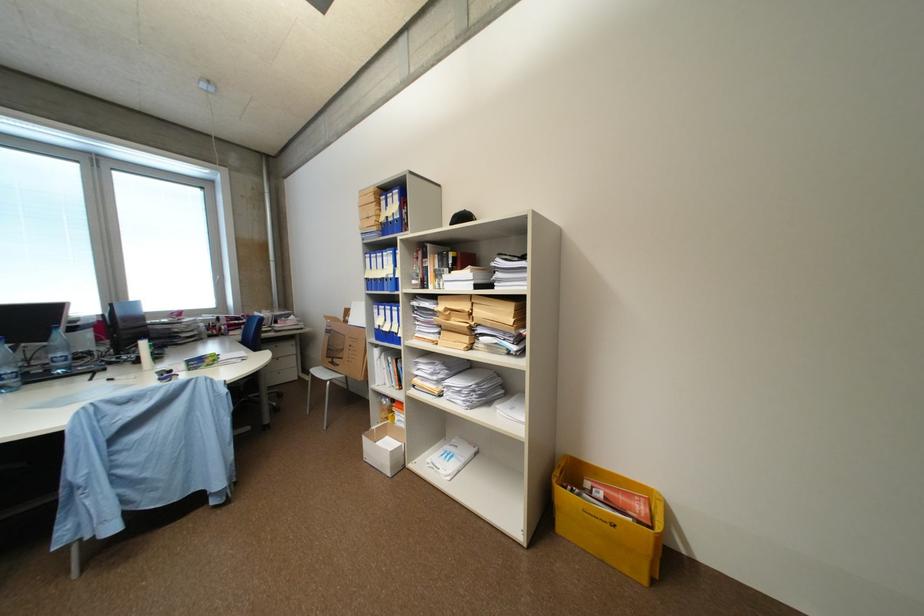
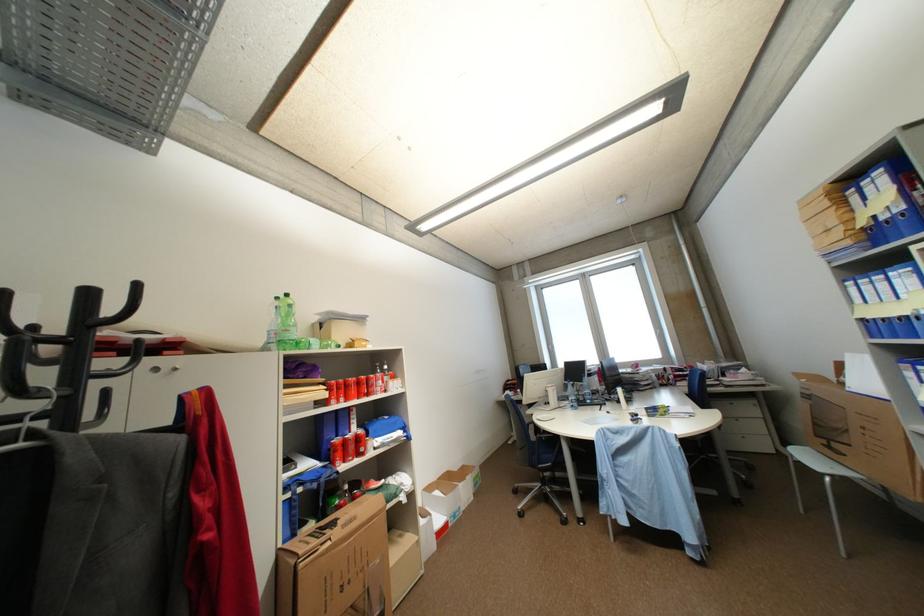
Question: The camera is either moving clockwise (left) or counter-clockwise (right) around the object. The first image is from the beginning of the video and the second image is from the end. Is the camera moving left or right when shooting the video?

Choices:
 (A) Left
 (B) Right

Answer: (B)